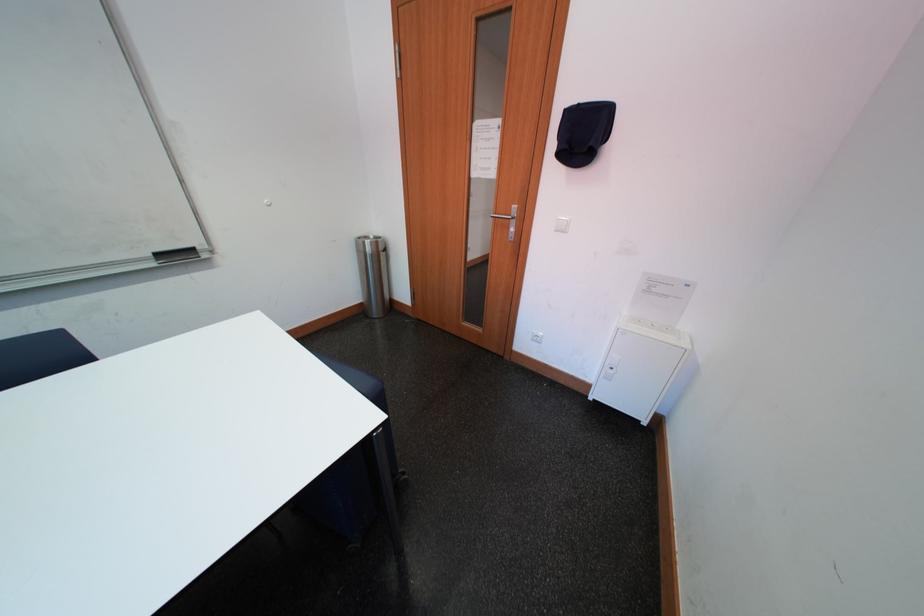
Where is `black whiteboard eraser`? black whiteboard eraser is located at coordinates (176, 254).